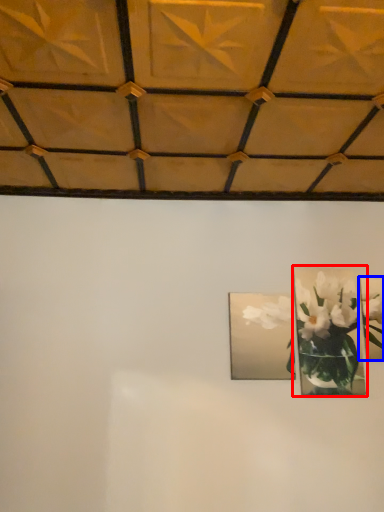
Question: Which of the following is the farthest to the observer, picture frame (highlighted by a red box) or picture frame (highlighted by a blue box)?

Choices:
 (A) picture frame
 (B) picture frame

Answer: (B)